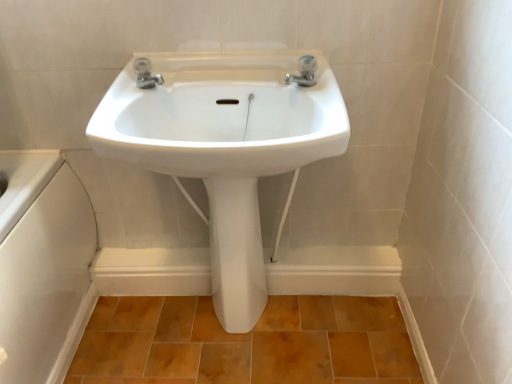
Image resolution: width=512 pixels, height=384 pixels. What are the coordinates of `vacant space behind satin nickel faucet at upper center, acting as the first tap starting from the left` in the screenshot? It's located at (176, 72).